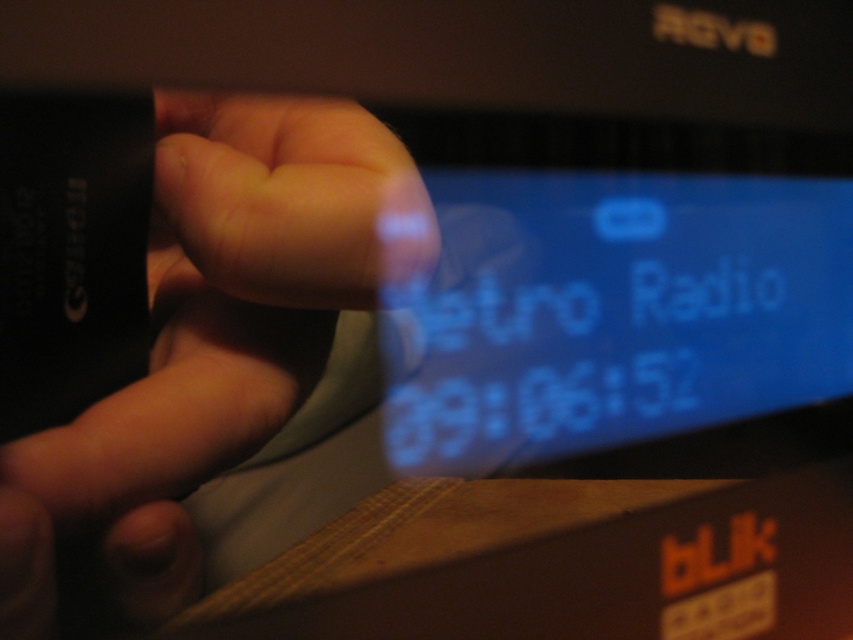
Question: Among these points, which one is farthest from the camera?

Choices:
 (A) (837, 628)
 (B) (759, 385)

Answer: (A)

Question: Does skinny-fingered hand at center have a greater width compared to wooden box at lower right?

Choices:
 (A) no
 (B) yes

Answer: (A)

Question: Does blue glossy display at center appear on the right side of skinny-fingered hand at center?

Choices:
 (A) no
 (B) yes

Answer: (B)

Question: Among these objects, which one is farthest from the camera?

Choices:
 (A) wooden box at lower right
 (B) blue glossy display at center

Answer: (B)

Question: Considering the relative positions of blue glossy display at center and wooden box at lower right in the image provided, where is blue glossy display at center located with respect to wooden box at lower right?

Choices:
 (A) left
 (B) right

Answer: (B)

Question: Considering the real-world distances, which object is closest to the wooden box at lower right?

Choices:
 (A) blue glossy display at center
 (B) skinny-fingered hand at center

Answer: (A)